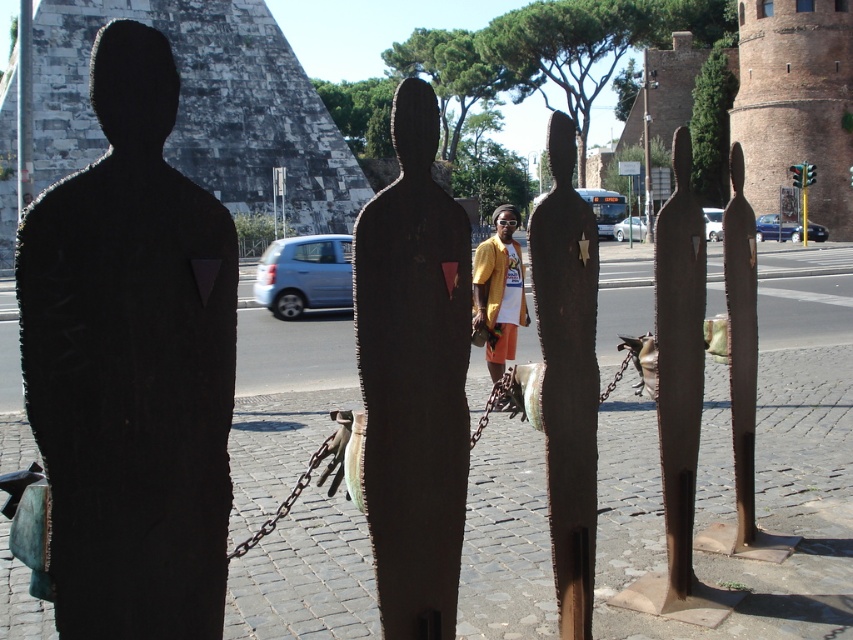
Question: Does rusty metal figure at center come in front of brushed metal pole at upper left?

Choices:
 (A) yes
 (B) no

Answer: (A)

Question: Is rusty metal figure at center to the left of brushed metal pole at upper left from the viewer's perspective?

Choices:
 (A) no
 (B) yes

Answer: (A)

Question: Which of the following is the closest to the observer?

Choices:
 (A) (131, 77)
 (B) (724, 333)
 (C) (68, 128)
 (D) (407, 513)

Answer: (A)

Question: Estimate the real-world distances between objects in this image. Which object is closer to the rusty metal sculpture at center?

Choices:
 (A) black matte statue at left
 (B) rustic wood figure at center

Answer: (B)

Question: Can you confirm if black matte statue at left is positioned to the left of dark gray stone pyramid at upper left?

Choices:
 (A) yes
 (B) no

Answer: (B)

Question: Which point is closer to the camera taking this photo?

Choices:
 (A) (505, 352)
 (B) (305, 216)
 (C) (645, 132)
 (D) (386, 456)

Answer: (D)